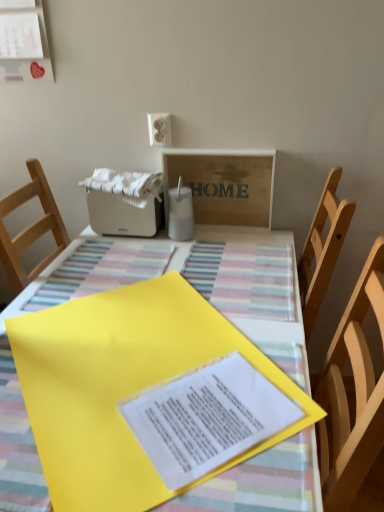
Question: Which is correct: wooden signboard at upper center is inside yellow paper at center, or outside of it?

Choices:
 (A) outside
 (B) inside

Answer: (A)

Question: From the image's perspective, relative to yellow paper at center, is wooden signboard at upper center above or below?

Choices:
 (A) below
 (B) above

Answer: (B)

Question: Which of these objects is positioned farthest from the wooden signboard at upper center?

Choices:
 (A) yellow paper at center
 (B) matte white paper at upper left
 (C) yellow paper at center
 (D) white plastic toaster at upper center

Answer: (A)

Question: Which of these objects is positioned closest to the yellow paper at center?

Choices:
 (A) white plastic toaster at upper center
 (B) wooden signboard at upper center
 (C) matte white paper at upper left
 (D) yellow paper at center

Answer: (D)